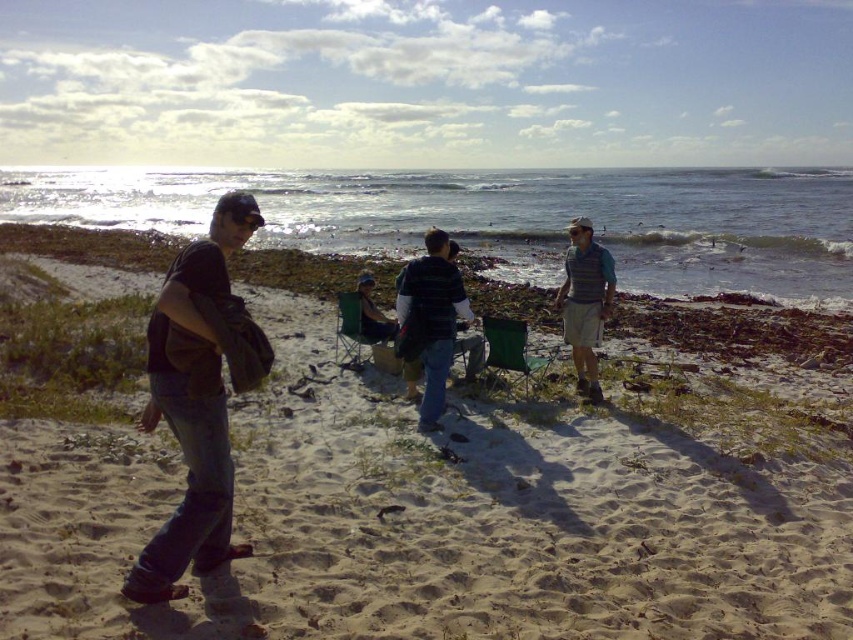
You are a photographer standing at the center of the beach. You want to take a photo that includes both the dark brown leather jacket at left and the gray knit vest at right. How far apart are these two items in the image?

The dark brown leather jacket at left and the gray knit vest at right are 17.35 feet apart, so they are 17.35 feet apart in the image.

You are a photographer trying to capture a photo of the sandy beach at center and the gray knit vest at right. Based on their heights, which object should you focus on first to ensure both are in frame?

The sandy beach at center has a greater height compared to the gray knit vest at right, so you should focus on the sandy beach at center first to ensure both are in frame.